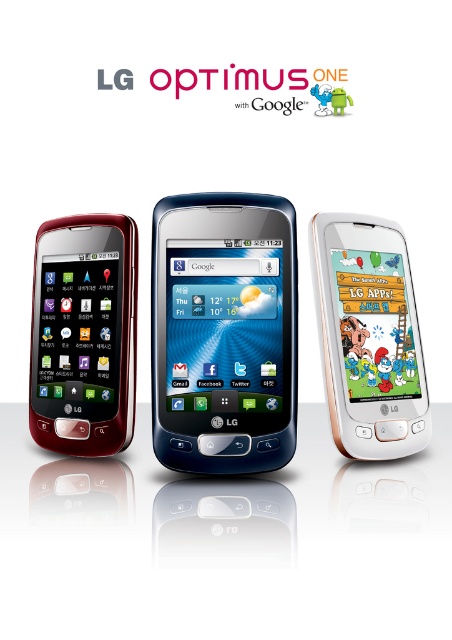
You are a delivery robot with a 12 inch wide box. You need to place the box between the matte black phone at left and the white glossy smartphone at right. Can you fit the box between them without overlapping either device?

The distance between the matte black phone at left and the white glossy smartphone at right is 11.69 inches. Since the box is 12 inches wide, it cannot fit between them as the space is slightly narrower than the box.

You are holding a matte black phone at left and a white glossy smartphone at right. Which one is taller?

The white glossy smartphone at right is taller than the matte black phone at left.